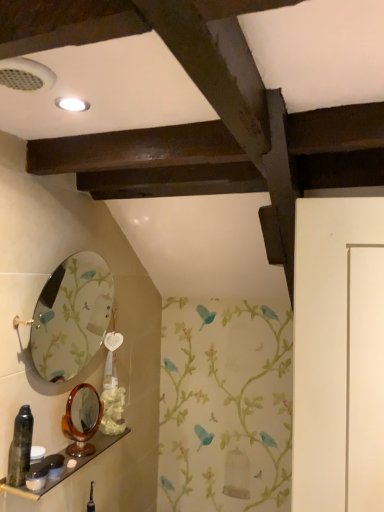
Question: Would you say wooden shelf at lower left is to the left or to the right of oval glass mirror at upper left, which is counted as the first mirror, starting from the top, in the picture?

Choices:
 (A) right
 (B) left

Answer: (A)

Question: From the image's perspective, is wooden shelf at lower left above or below oval glass mirror at upper left, placed as the 2th mirror when sorted from bottom to top?

Choices:
 (A) above
 (B) below

Answer: (B)

Question: Which is farther from the oval glass mirror at upper left, which is counted as the first mirror, starting from the top?

Choices:
 (A) wooden shelf at lower left
 (B) brown glossy mirror at center, the 2th mirror positioned from the top
 (C) matte black spray can at lower left
 (D) matte black container at lower left

Answer: (C)

Question: Which object is the farthest from the wooden shelf at lower left?

Choices:
 (A) matte black spray can at lower left
 (B) brown glossy mirror at center, the first mirror when ordered from bottom to top
 (C) oval glass mirror at upper left, placed as the 2th mirror when sorted from bottom to top
 (D) matte black container at lower left

Answer: (C)